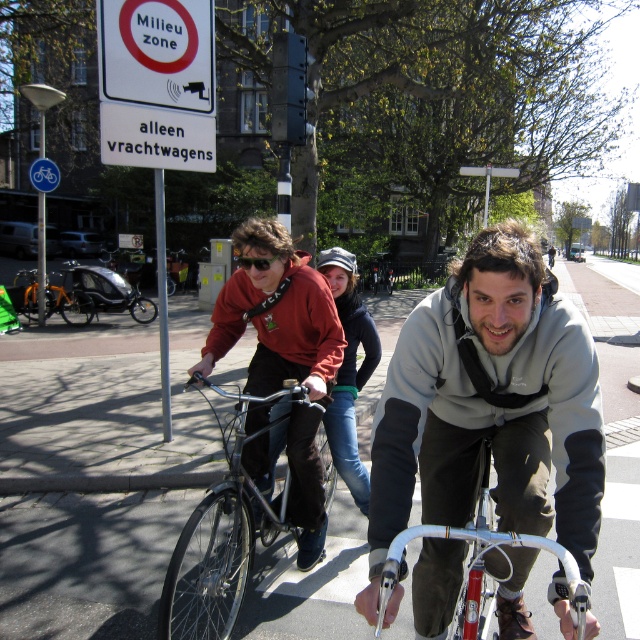
Question: Can you confirm if matte black jacket at center is positioned to the right of orange matte bicycle at center?

Choices:
 (A) no
 (B) yes

Answer: (B)

Question: Which point is closer to the camera?

Choices:
 (A) shiny silver helmet at center
 (B) gray fleece jacket at center

Answer: (B)

Question: Which object is positioned closest to the gray fleece jacket at center?

Choices:
 (A) silver metallic bicycle at center
 (B) orange matte bicycle at center

Answer: (A)

Question: Is blue plastic bicycle at upper left above shiny silver helmet at center?

Choices:
 (A) yes
 (B) no

Answer: (A)

Question: Which of the following is the farthest from the observer?

Choices:
 (A) orange matte bicycle at center
 (B) blue plastic bicycle at upper left
 (C) gray fleece jacket at center
 (D) shiny metallic bicycle at center

Answer: (A)

Question: Does gray fleece jacket at center have a lesser width compared to orange matte bicycle at center?

Choices:
 (A) no
 (B) yes

Answer: (B)